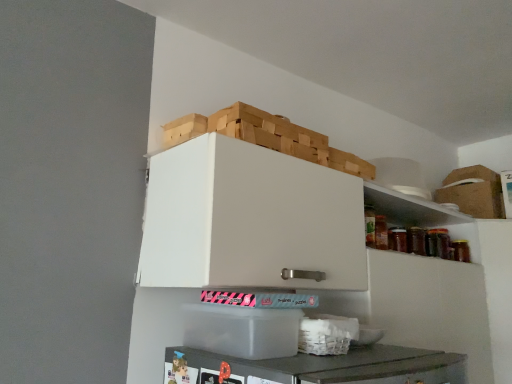
This screenshot has height=384, width=512. Describe the element at coordinates (241, 330) in the screenshot. I see `transparent plastic container at lower center, the first cardboard box when ordered from front to back` at that location.

This screenshot has width=512, height=384. Describe the element at coordinates (473, 192) in the screenshot. I see `brown cardboard box at upper right, which appears as the 2th cardboard box when ordered from the bottom` at that location.

This screenshot has width=512, height=384. I want to click on brown cardboard box at upper right, placed as the first cardboard box when sorted from right to left, so click(473, 192).

Identify the location of wooden crate at upper center. The image size is (512, 384). (268, 137).

Locate an element on the screen. transparent plastic container at lower center, the first cardboard box when ordered from front to back is located at coordinates (241, 330).

Is wooden crate at upper center spatially inside transparent plastic container at lower center, positioned as the 2th cardboard box in back-to-front order, or outside of it?

wooden crate at upper center is not enclosed by transparent plastic container at lower center, positioned as the 2th cardboard box in back-to-front order.

Is point (308, 138) in front of point (267, 320)?

No.

Measure the distance from wooden crate at upper center to transparent plastic container at lower center, the first cardboard box when ordered from front to back.

wooden crate at upper center is 19.02 inches from transparent plastic container at lower center, the first cardboard box when ordered from front to back.

Can you confirm if wooden crate at upper center is shorter than transparent plastic container at lower center, the 2th cardboard box positioned from the top?

Indeed, wooden crate at upper center has a lesser height compared to transparent plastic container at lower center, the 2th cardboard box positioned from the top.

I want to click on crate to the left of brown cardboard box at upper right, which appears as the 2th cardboard box when ordered from the bottom, so click(x=268, y=137).

Is the position of brown cardboard box at upper right, the 1th cardboard box from the back, less distant than that of wooden crate at upper center?

No, it is behind wooden crate at upper center.

Could you tell me if brown cardboard box at upper right, the first cardboard box from the top, is facing wooden crate at upper center?

Yes, brown cardboard box at upper right, the first cardboard box from the top, is aimed at wooden crate at upper center.

What's the angular difference between brown cardboard box at upper right, which is the second cardboard box from left to right, and wooden crate at upper center's facing directions?

→ There is a 90-degree angle between the facing directions of brown cardboard box at upper right, which is the second cardboard box from left to right, and wooden crate at upper center.

Is transparent plastic container at lower center, the 2th cardboard box positioned from the top, looking in the opposite direction of wooden crate at upper center?

transparent plastic container at lower center, the 2th cardboard box positioned from the top, is not turned away from wooden crate at upper center.

Can you confirm if transparent plastic container at lower center, arranged as the 1th cardboard box when ordered from the bottom, is taller than wooden crate at upper center?

Yes, transparent plastic container at lower center, arranged as the 1th cardboard box when ordered from the bottom, is taller than wooden crate at upper center.

Does transparent plastic container at lower center, which appears as the second cardboard box when viewed from the right, have a larger size compared to wooden crate at upper center?

No, transparent plastic container at lower center, which appears as the second cardboard box when viewed from the right, is not bigger than wooden crate at upper center.

Is the depth of transparent plastic container at lower center, which appears as the second cardboard box when viewed from the right, greater than that of wooden crate at upper center?

No, transparent plastic container at lower center, which appears as the second cardboard box when viewed from the right, is closer to the camera.

Considering the relative sizes of white woven basket at lower center and transparent plastic container at lower center, arranged as the 1th cardboard box when ordered from the bottom, in the image provided, is white woven basket at lower center shorter than transparent plastic container at lower center, arranged as the 1th cardboard box when ordered from the bottom,?

Correct, white woven basket at lower center is not as tall as transparent plastic container at lower center, arranged as the 1th cardboard box when ordered from the bottom.

Which of these two, white woven basket at lower center or transparent plastic container at lower center, which appears as the second cardboard box when viewed from the right, is thinner?

white woven basket at lower center is thinner.

From the picture: Is white woven basket at lower center at the left side of transparent plastic container at lower center, the 2th cardboard box positioned from the top?

No, white woven basket at lower center is not to the left of transparent plastic container at lower center, the 2th cardboard box positioned from the top.

Could you tell me if brown cardboard box at upper right, the 1th cardboard box from the back, is facing white woven basket at lower center?

Yes, brown cardboard box at upper right, the 1th cardboard box from the back, is facing white woven basket at lower center.

Would you say brown cardboard box at upper right, the first cardboard box from the top, contains white woven basket at lower center?

Definitely not — white woven basket at lower center is not inside brown cardboard box at upper right, the first cardboard box from the top.

Image resolution: width=512 pixels, height=384 pixels. What are the coordinates of `cardboard box located on the right of white woven basket at lower center` in the screenshot? It's located at (473, 192).

Is point (197, 312) closer or farther from the camera than point (482, 187)?

Point (197, 312) appears to be closer to the viewer than point (482, 187).

Is transparent plastic container at lower center, which is counted as the first cardboard box, starting from the left, behind brown cardboard box at upper right, which is the second cardboard box from left to right?

No, transparent plastic container at lower center, which is counted as the first cardboard box, starting from the left, is closer to the camera.

Is transparent plastic container at lower center, which appears as the second cardboard box when viewed from the right, facing away from brown cardboard box at upper right, which is the second cardboard box from left to right?

No, transparent plastic container at lower center, which appears as the second cardboard box when viewed from the right, is not facing away from brown cardboard box at upper right, which is the second cardboard box from left to right.

Is transparent plastic container at lower center, positioned as the 2th cardboard box in back-to-front order, shorter than brown cardboard box at upper right, placed as the first cardboard box when sorted from right to left?

Correct, transparent plastic container at lower center, positioned as the 2th cardboard box in back-to-front order, is not as tall as brown cardboard box at upper right, placed as the first cardboard box when sorted from right to left.

Which is closer to the camera, (500, 205) or (260, 329)?

The point (260, 329) is closer.

Does brown cardboard box at upper right, the 1th cardboard box from the back, turn towards transparent plastic container at lower center, positioned as the 2th cardboard box in back-to-front order?

Yes, brown cardboard box at upper right, the 1th cardboard box from the back, is oriented towards transparent plastic container at lower center, positioned as the 2th cardboard box in back-to-front order.

Considering the relative sizes of brown cardboard box at upper right, the 1th cardboard box from the back, and transparent plastic container at lower center, which is counted as the first cardboard box, starting from the left, in the image provided, is brown cardboard box at upper right, the 1th cardboard box from the back, taller than transparent plastic container at lower center, which is counted as the first cardboard box, starting from the left,?

Indeed, brown cardboard box at upper right, the 1th cardboard box from the back, has a greater height compared to transparent plastic container at lower center, which is counted as the first cardboard box, starting from the left.

Is brown cardboard box at upper right, placed as the first cardboard box when sorted from right to left, positioned in front of transparent plastic container at lower center, arranged as the 1th cardboard box when ordered from the bottom?

No, it is behind transparent plastic container at lower center, arranged as the 1th cardboard box when ordered from the bottom.

The width and height of the screenshot is (512, 384). I want to click on cardboard box beneath the wooden crate at upper center (from a real-world perspective), so click(x=241, y=330).

At what (x,y) coordinates should I click in order to perform the action: click on crate in front of the brown cardboard box at upper right, placed as the first cardboard box when sorted from right to left. Please return your answer as a coordinate pair (x, y). The height and width of the screenshot is (384, 512). Looking at the image, I should click on (268, 137).

From the picture: When comparing their distances from transparent plastic container at lower center, positioned as the 2th cardboard box in back-to-front order, does white woven basket at lower center or wooden crate at upper center seem closer?

white woven basket at lower center is positioned closer to the anchor transparent plastic container at lower center, positioned as the 2th cardboard box in back-to-front order.

Looking at the image, which one is located further to wooden crate at upper center, white woven basket at lower center or brown cardboard box at upper right, the first cardboard box from the top?

brown cardboard box at upper right, the first cardboard box from the top.

When comparing their distances from wooden crate at upper center, does white woven basket at lower center or transparent plastic container at lower center, arranged as the 1th cardboard box when ordered from the bottom, seem closer?

transparent plastic container at lower center, arranged as the 1th cardboard box when ordered from the bottom, is positioned closer to the anchor wooden crate at upper center.

Considering their positions, is transparent plastic container at lower center, the first cardboard box when ordered from front to back, positioned closer to brown cardboard box at upper right, the 1th cardboard box from the back, than white woven basket at lower center?

white woven basket at lower center.

Estimate the real-world distances between objects in this image. Which object is further from wooden crate at upper center, brown cardboard box at upper right, the first cardboard box from the top, or transparent plastic container at lower center, which is counted as the first cardboard box, starting from the left?

brown cardboard box at upper right, the first cardboard box from the top.

Looking at the image, which one is located closer to transparent plastic container at lower center, which is counted as the first cardboard box, starting from the left, white woven basket at lower center or brown cardboard box at upper right, which appears as the 2th cardboard box when ordered from the bottom?

Among the two, white woven basket at lower center is located nearer to transparent plastic container at lower center, which is counted as the first cardboard box, starting from the left.

Looking at the image, which one is located further to white woven basket at lower center, transparent plastic container at lower center, which is counted as the first cardboard box, starting from the left, or brown cardboard box at upper right, the 1th cardboard box from the back?

brown cardboard box at upper right, the 1th cardboard box from the back, is further to white woven basket at lower center.

Estimate the real-world distances between objects in this image. Which object is further from wooden crate at upper center, transparent plastic container at lower center, which is counted as the first cardboard box, starting from the left, or brown cardboard box at upper right, which is the second cardboard box from left to right?

brown cardboard box at upper right, which is the second cardboard box from left to right, is positioned further to the anchor wooden crate at upper center.

At what (x,y) coordinates should I click in order to perform the action: click on crate between transparent plastic container at lower center, which appears as the second cardboard box when viewed from the right, and brown cardboard box at upper right, placed as the first cardboard box when sorted from right to left, from left to right. Please return your answer as a coordinate pair (x, y). The image size is (512, 384). Looking at the image, I should click on (268, 137).

Find the location of a particular element. The image size is (512, 384). cardboard box positioned between white woven basket at lower center and brown cardboard box at upper right, which appears as the 2th cardboard box when ordered from the bottom, from near to far is located at coordinates (241, 330).

Where is `crate between white woven basket at lower center and brown cardboard box at upper right, which is the second cardboard box from left to right, along the z-axis`? The height and width of the screenshot is (384, 512). crate between white woven basket at lower center and brown cardboard box at upper right, which is the second cardboard box from left to right, along the z-axis is located at coordinates (268, 137).